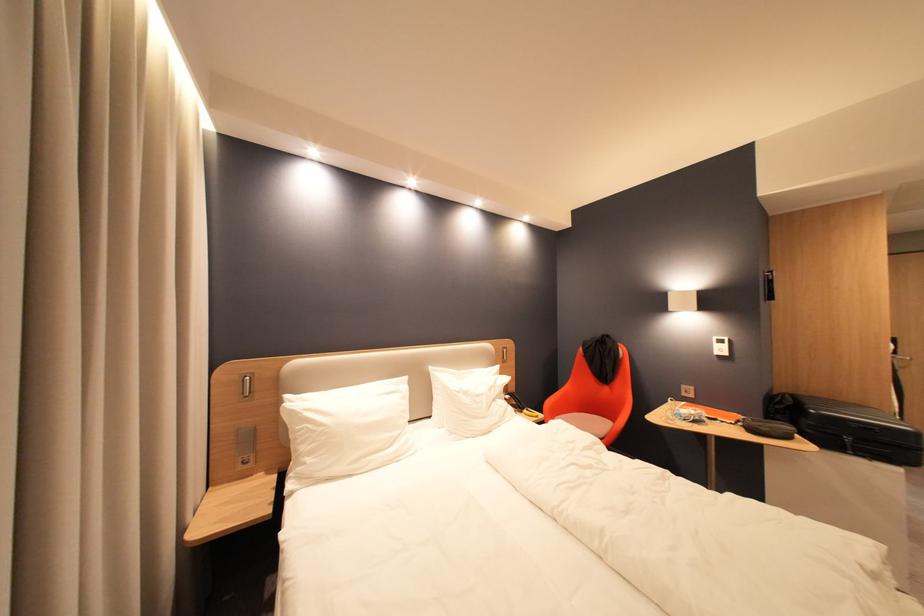
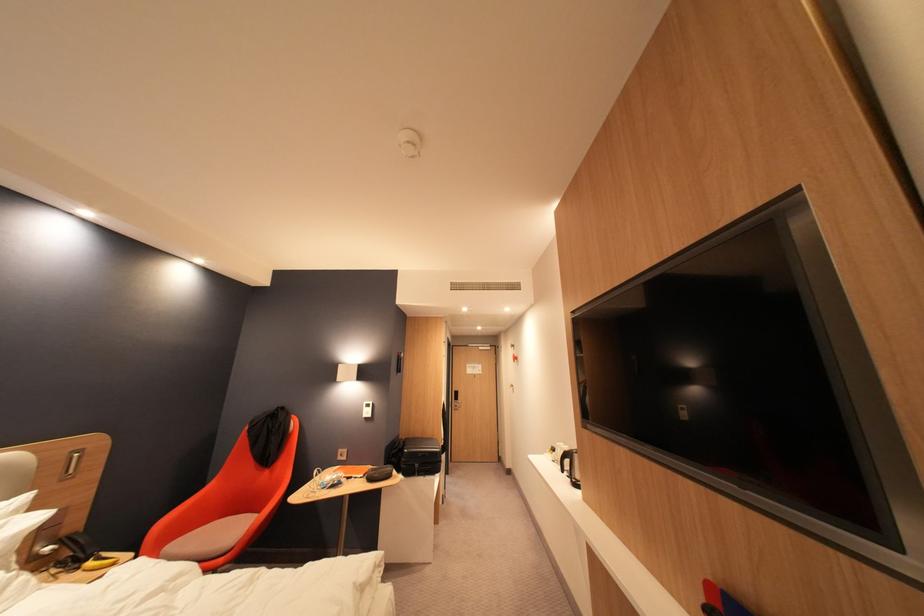
The point at (857, 440) is marked in the first image. Where is the corresponding point in the second image?

(427, 467)